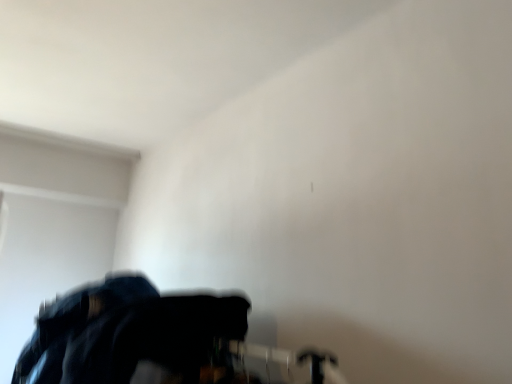
Measure the distance between dark blue fabric jacket at lower left and camera.

1.07 meters.

At what (x,y) coordinates should I click in order to perform the action: click on dark blue fabric jacket at lower left. Please return your answer as a coordinate pair (x, y). The image size is (512, 384). Looking at the image, I should click on (125, 332).

Describe the element at coordinates (125, 332) in the screenshot. I see `dark blue fabric jacket at lower left` at that location.

This screenshot has height=384, width=512. In order to click on dark blue fabric jacket at lower left in this screenshot , I will do `click(125, 332)`.